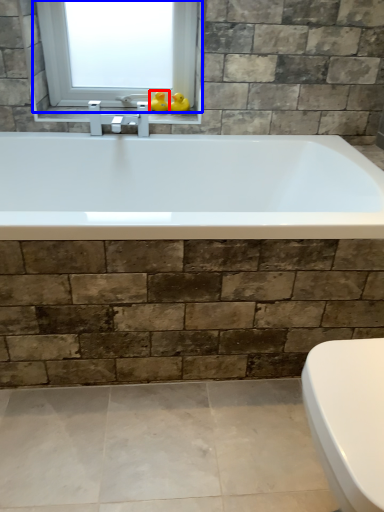
Question: Among these objects, which one is farthest to the camera, duck (highlighted by a red box) or window (highlighted by a blue box)?

Choices:
 (A) duck
 (B) window

Answer: (A)